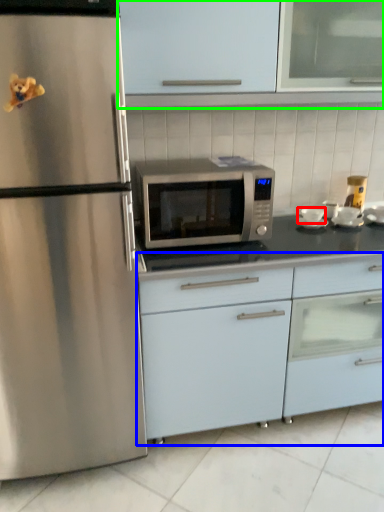
Question: Which is nearer to the appliance (highlighted by a red box)? cabinetry (highlighted by a blue box) or cabinetry (highlighted by a green box).

Choices:
 (A) cabinetry
 (B) cabinetry

Answer: (A)